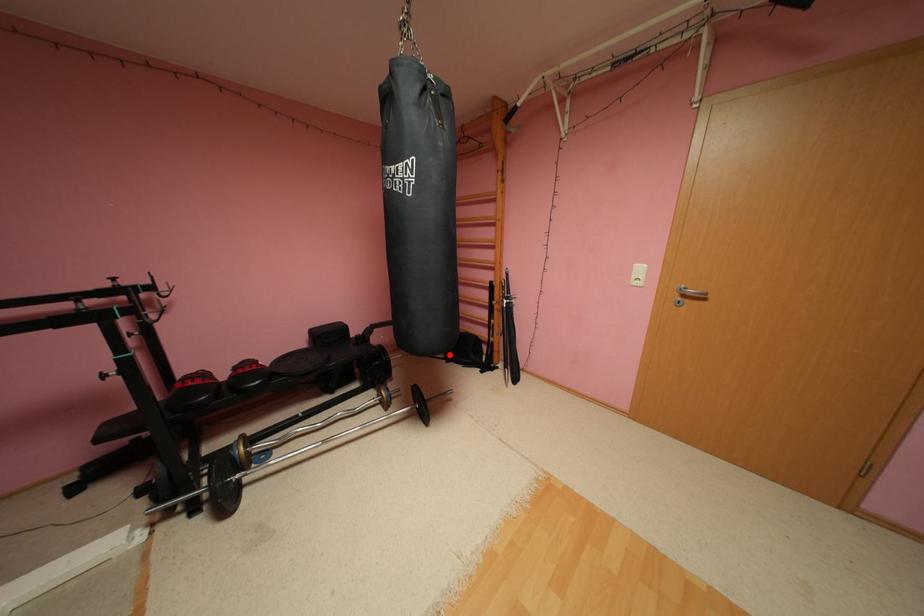
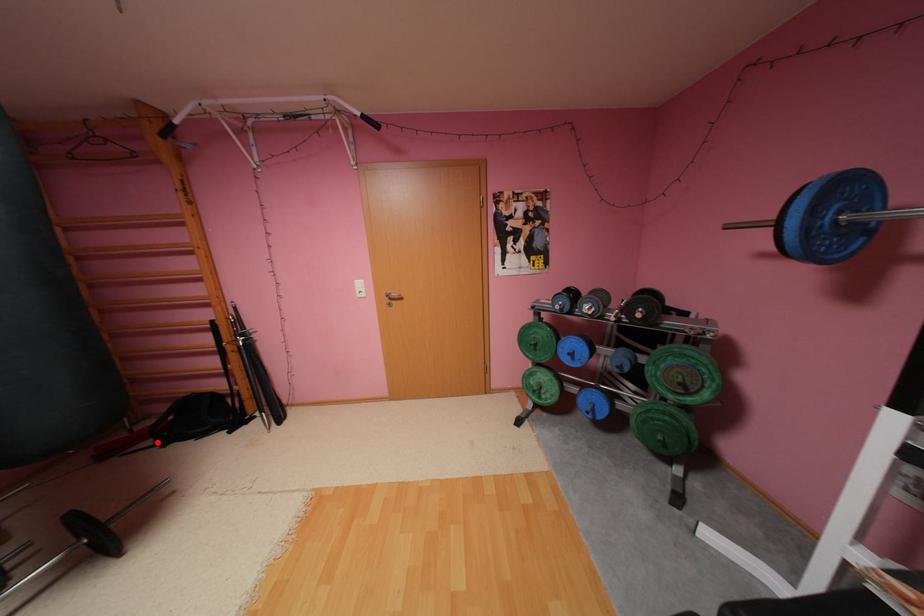
I am providing you with two images of the same scene from different viewpoints. A red point is marked on the first image and another point is marked on the second image. Are the points marked in image1 and image2 representing the same 3D position?

Yes